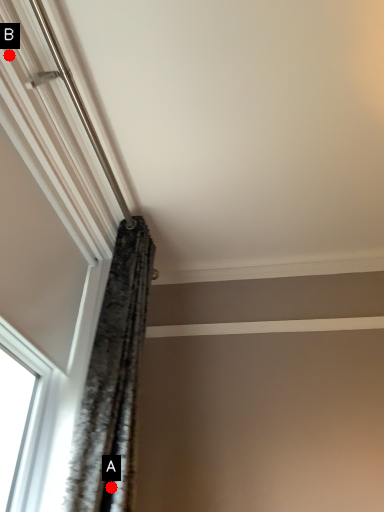
Question: Two points are circled on the image, labeled by A and B beside each circle. Which point appears closest to the camera in this image?

Choices:
 (A) A is closer
 (B) B is closer

Answer: (B)